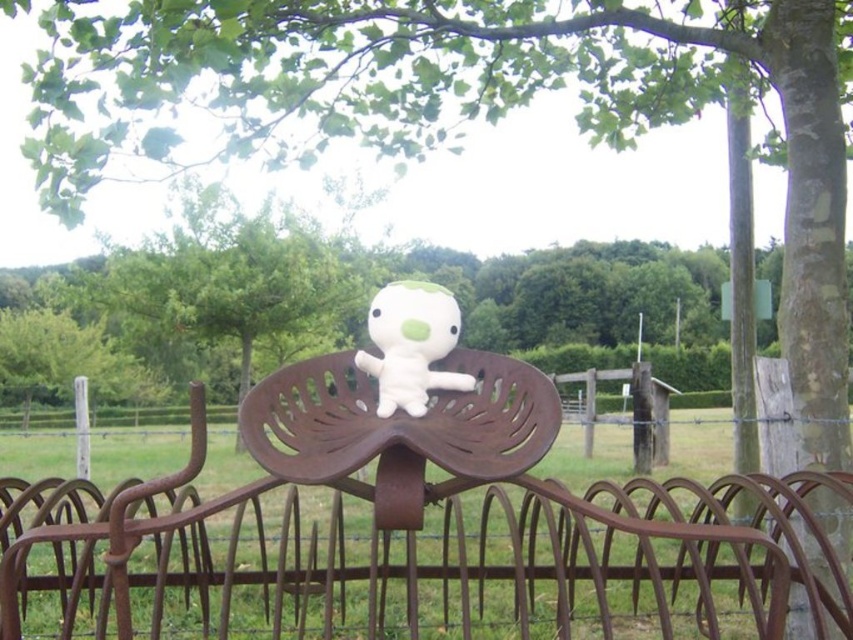
This screenshot has height=640, width=853. Find the location of `rusty metal rake at center`. rusty metal rake at center is located at coordinates coord(407,529).

Which is in front, point (351, 400) or point (412, 307)?

Point (412, 307) is more forward.

Where is `rusty metal rake at center`? rusty metal rake at center is located at coordinates (407, 529).